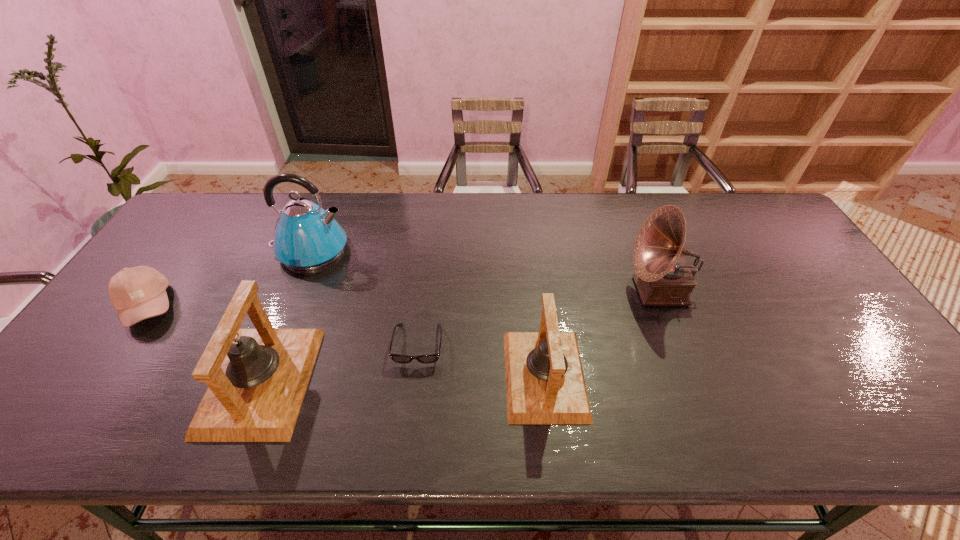
Where is `free location that satisfies the following two spatial constraints: 1. on the lenses of the shorter bell; 2. on the right side of the third object from right to left`? The image size is (960, 540). free location that satisfies the following two spatial constraints: 1. on the lenses of the shorter bell; 2. on the right side of the third object from right to left is located at coordinates (415, 375).

The height and width of the screenshot is (540, 960). Identify the location of vacant space that satisfies the following two spatial constraints: 1. at the spout of the kettle; 2. on the left side of the left bell. (257, 381).

Identify the location of free space that satisfies the following two spatial constraints: 1. on the front-facing side of the left bell; 2. on the right side of the baseball cap. The width and height of the screenshot is (960, 540). pyautogui.click(x=94, y=381).

Identify the location of vacant area that satisfies the following two spatial constraints: 1. on the front-facing side of the leftmost object; 2. on the left side of the second object from right to left. Image resolution: width=960 pixels, height=540 pixels. click(x=98, y=375).

The width and height of the screenshot is (960, 540). In order to click on free space that satisfies the following two spatial constraints: 1. on the back side of the taller bell; 2. at the spout of the kettle in this screenshot , I will do `click(314, 251)`.